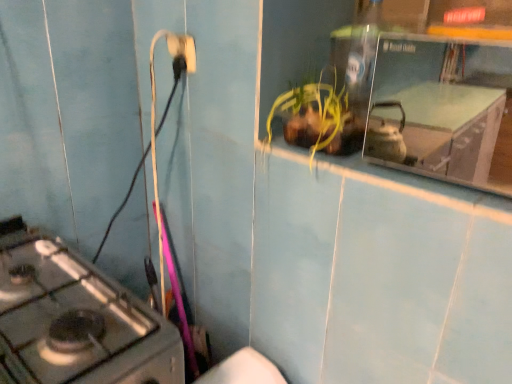
The height and width of the screenshot is (384, 512). What are the coordinates of `metallic gray gas stove at lower left` in the screenshot? It's located at (76, 320).

The height and width of the screenshot is (384, 512). Describe the element at coordinates (76, 320) in the screenshot. I see `metallic gray gas stove at lower left` at that location.

In order to click on white plastic electric outlet at upper center in this screenshot , I will do `click(183, 49)`.

What is the approximate width of white plastic electric outlet at upper center?

It is 0.77 inches.

This screenshot has width=512, height=384. What do you see at coordinates (183, 49) in the screenshot?
I see `white plastic electric outlet at upper center` at bounding box center [183, 49].

At what (x,y) coordinates should I click in order to perform the action: click on metallic gray gas stove at lower left. Please return your answer as a coordinate pair (x, y). Looking at the image, I should click on (76, 320).

Does white plastic electric outlet at upper center appear on the left side of metallic gray gas stove at lower left?

No, white plastic electric outlet at upper center is not to the left of metallic gray gas stove at lower left.

Is white plastic electric outlet at upper center in front of or behind metallic gray gas stove at lower left in the image?

white plastic electric outlet at upper center is behind metallic gray gas stove at lower left.

Between point (176, 47) and point (146, 305), which one is positioned in front?

The point (146, 305) is more forward.

From the image's perspective, which object appears higher, white plastic electric outlet at upper center or metallic gray gas stove at lower left?

white plastic electric outlet at upper center, from the image's perspective.

From the picture: From a real-world perspective, is white plastic electric outlet at upper center positioned above or below metallic gray gas stove at lower left?

white plastic electric outlet at upper center is above metallic gray gas stove at lower left.

Does white plastic electric outlet at upper center have a lesser width compared to metallic gray gas stove at lower left?

Indeed, white plastic electric outlet at upper center has a lesser width compared to metallic gray gas stove at lower left.

Does white plastic electric outlet at upper center have a greater height compared to metallic gray gas stove at lower left?

No.

Does white plastic electric outlet at upper center have a larger size compared to metallic gray gas stove at lower left?

Actually, white plastic electric outlet at upper center might be smaller than metallic gray gas stove at lower left.

Do you think white plastic electric outlet at upper center is within metallic gray gas stove at lower left, or outside of it?

The correct answer is: outside.

Are white plastic electric outlet at upper center and metallic gray gas stove at lower left located far from each other?

That's not correct — white plastic electric outlet at upper center is a little close to metallic gray gas stove at lower left.

Is white plastic electric outlet at upper center oriented towards metallic gray gas stove at lower left?

No.

How much distance is there between white plastic electric outlet at upper center and metallic gray gas stove at lower left?

white plastic electric outlet at upper center is 25.38 inches from metallic gray gas stove at lower left.

Where is `electric outlet above the metallic gray gas stove at lower left (from a real-world perspective)`? electric outlet above the metallic gray gas stove at lower left (from a real-world perspective) is located at coordinates (183, 49).

Based on their positions, is metallic gray gas stove at lower left located to the left or right of white plastic electric outlet at upper center?

In the image, metallic gray gas stove at lower left appears on the left side of white plastic electric outlet at upper center.

Between metallic gray gas stove at lower left and white plastic electric outlet at upper center, which one is positioned in front?

metallic gray gas stove at lower left is more forward.

Based on the photo, which is nearer, (75,288) or (191,45)?

The point (75,288) is closer to the camera.

From the image's perspective, which one is positioned higher, metallic gray gas stove at lower left or white plastic electric outlet at upper center?

white plastic electric outlet at upper center, from the image's perspective.

From a real-world perspective, is metallic gray gas stove at lower left on white plastic electric outlet at upper center?

No, from a real-world perspective, metallic gray gas stove at lower left is not over white plastic electric outlet at upper center

From the picture: Which of these two, metallic gray gas stove at lower left or white plastic electric outlet at upper center, is thinner?

With smaller width is white plastic electric outlet at upper center.

In terms of height, does metallic gray gas stove at lower left look taller or shorter compared to white plastic electric outlet at upper center?

In the image, metallic gray gas stove at lower left appears to be taller than white plastic electric outlet at upper center.

Considering the relative sizes of metallic gray gas stove at lower left and white plastic electric outlet at upper center in the image provided, is metallic gray gas stove at lower left smaller than white plastic electric outlet at upper center?

Actually, metallic gray gas stove at lower left might be larger than white plastic electric outlet at upper center.

Would you say metallic gray gas stove at lower left is inside or outside white plastic electric outlet at upper center?

metallic gray gas stove at lower left is not enclosed by white plastic electric outlet at upper center.

Is the surface of metallic gray gas stove at lower left in direct contact with white plastic electric outlet at upper center?

No, metallic gray gas stove at lower left is not making contact with white plastic electric outlet at upper center.

Is white plastic electric outlet at upper center at the back of metallic gray gas stove at lower left?

No, white plastic electric outlet at upper center is not at the back of metallic gray gas stove at lower left.

How much distance is there between metallic gray gas stove at lower left and white plastic electric outlet at upper center?

metallic gray gas stove at lower left and white plastic electric outlet at upper center are 25.38 inches apart from each other.

Where is `electric outlet above the metallic gray gas stove at lower left (from a real-world perspective)`? The width and height of the screenshot is (512, 384). electric outlet above the metallic gray gas stove at lower left (from a real-world perspective) is located at coordinates (183, 49).

In order to click on gas stove below the white plastic electric outlet at upper center (from the image's perspective) in this screenshot , I will do `click(76, 320)`.

Image resolution: width=512 pixels, height=384 pixels. What are the coordinates of `gas stove on the left of white plastic electric outlet at upper center` in the screenshot? It's located at (76, 320).